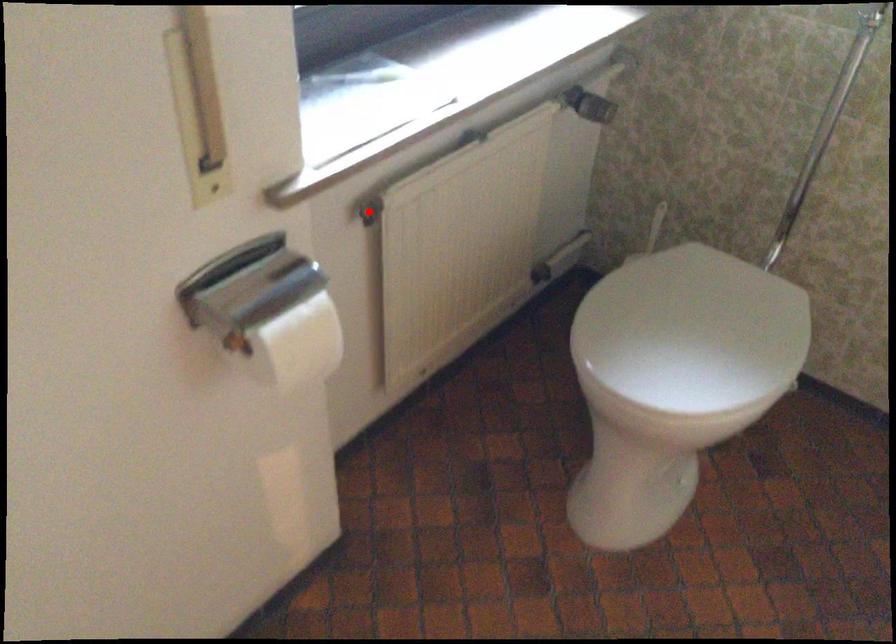
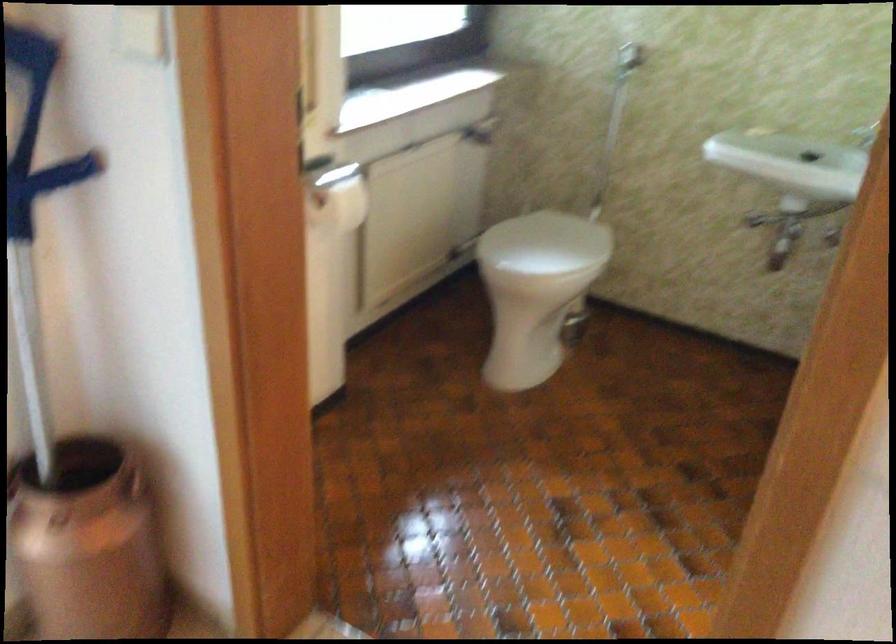
Question: I am providing you with two images of the same scene from different viewpoints. A red point is marked on the first image. Is the red point's position out of view in image 2?

Choices:
 (A) Yes
 (B) No

Answer: (A)